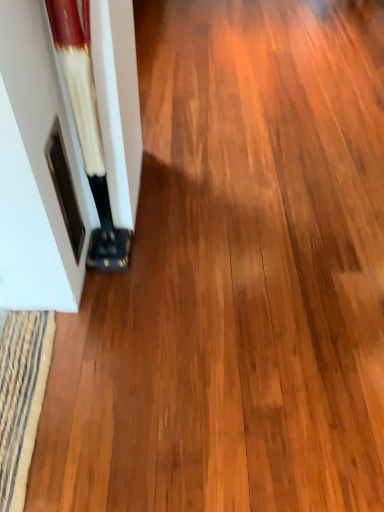
Where is `white glossy door at left`? The height and width of the screenshot is (512, 384). white glossy door at left is located at coordinates (37, 170).

Image resolution: width=384 pixels, height=512 pixels. What do you see at coordinates (37, 170) in the screenshot? I see `white glossy door at left` at bounding box center [37, 170].

You are a GUI agent. You are given a task and a screenshot of the screen. Output one action in this format:
    pyautogui.click(x=<x>, y=<y>)
    Task: Click on the white glossy door at left
    This screenshot has width=384, height=512.
    Given the screenshot: What is the action you would take?
    pyautogui.click(x=37, y=170)